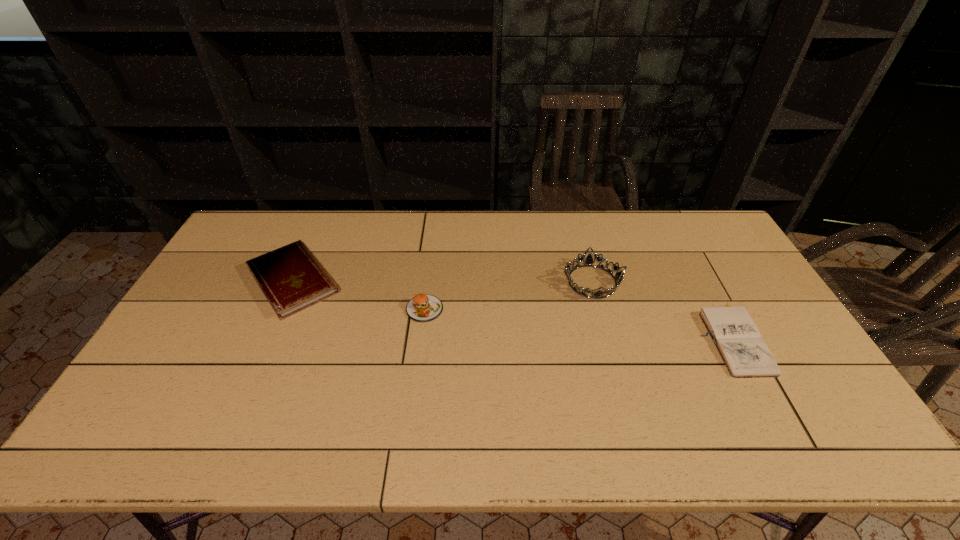
Point out which object is positioned as the second nearest to the right notebook. Please provide its 2D coordinates. Your answer should be formatted as a tuple, i.e. [(x, y)], where the tuple contains the x and y coordinates of a point satisfying the conditions above.

[(422, 308)]

At what (x,y) coordinates should I click in order to perform the action: click on free space in the image that satisfies the following two spatial constraints: 1. on the front-facing side of the third object from left to right; 2. on the left side of the right notebook. Please return your answer as a coordinate pair (x, y). Looking at the image, I should click on (607, 338).

Where is `vacant area in the image that satisfies the following two spatial constraints: 1. on the front side of the rightmost object; 2. on the right side of the third shortest object`? vacant area in the image that satisfies the following two spatial constraints: 1. on the front side of the rightmost object; 2. on the right side of the third shortest object is located at coordinates (420, 338).

Where is `free spot that satisfies the following two spatial constraints: 1. on the front-facing side of the tiara; 2. on the right side of the right notebook`? This screenshot has height=540, width=960. free spot that satisfies the following two spatial constraints: 1. on the front-facing side of the tiara; 2. on the right side of the right notebook is located at coordinates (607, 338).